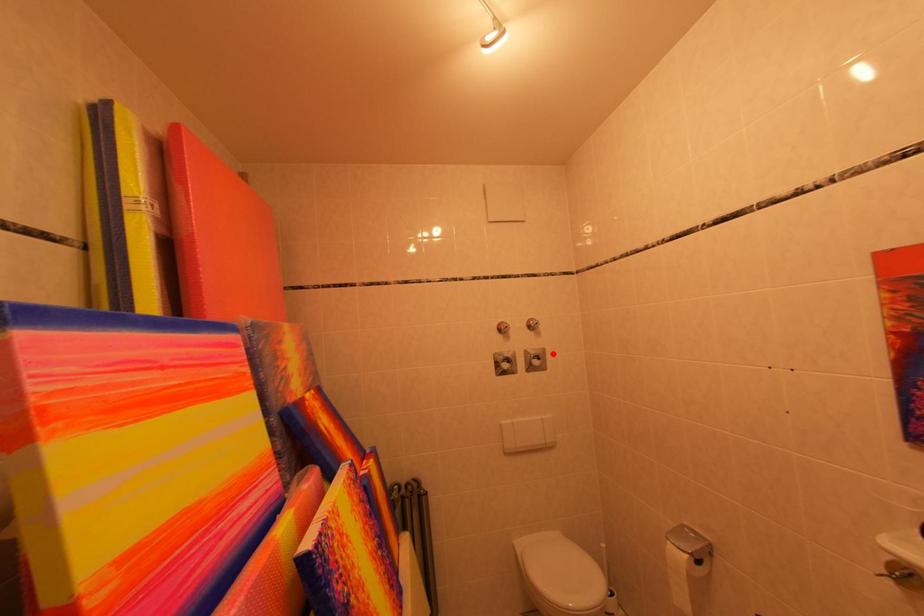
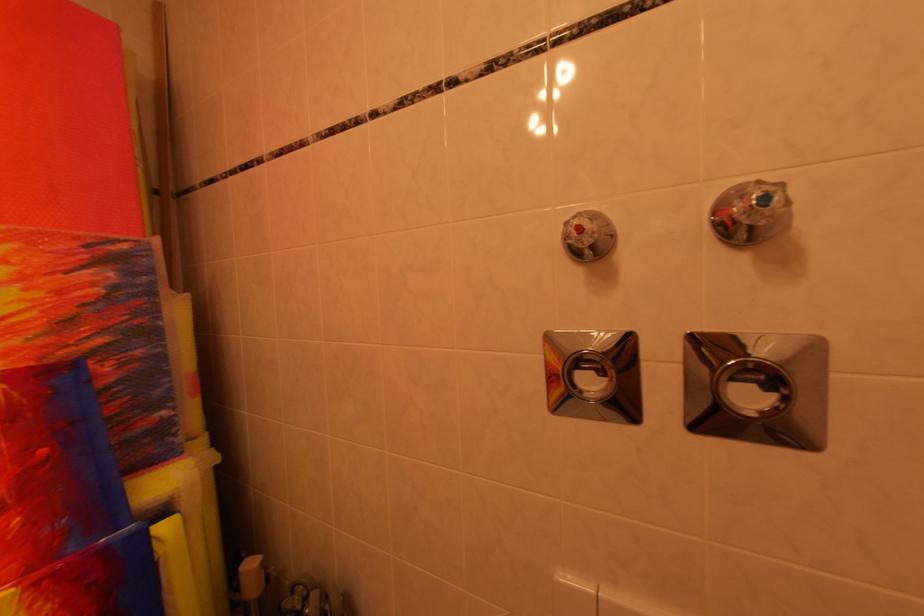
The point at the highlighted location is marked in the first image. Where is the corresponding point in the second image?

(824, 351)